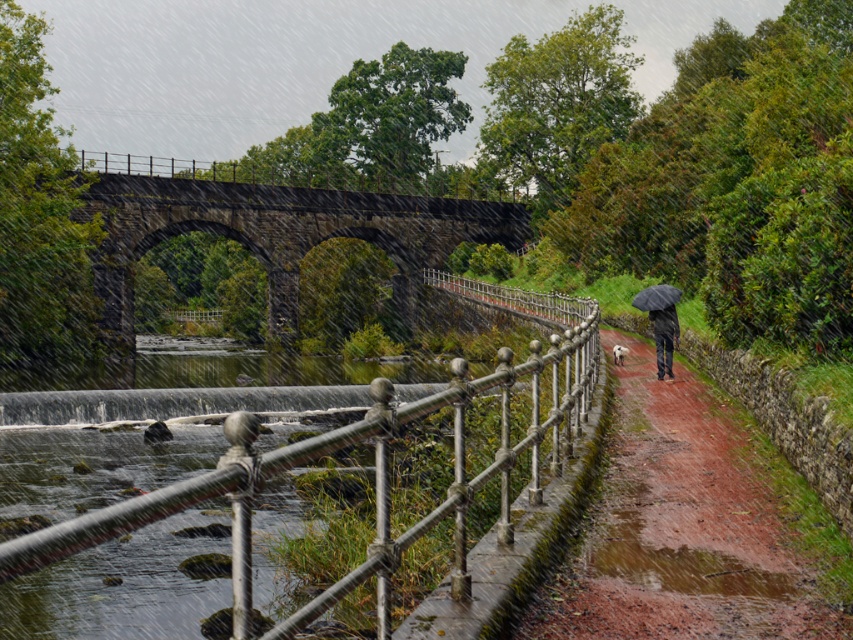
Does silver metallic railing at center appear under dark gray jeans at center-right?

Incorrect, silver metallic railing at center is not positioned below dark gray jeans at center-right.

Is silver metallic railing at center smaller than dark gray jeans at center-right?

No, silver metallic railing at center is not smaller than dark gray jeans at center-right.

Is point (593, 371) farther from viewer compared to point (672, 346)?

No, it is in front of (672, 346).

At what (x,y) coordinates should I click in order to perform the action: click on silver metallic railing at center. Please return your answer as a coordinate pair (x, y). Looking at the image, I should click on (374, 465).

Looking at this image, is the position of dark stone bridge at upper center more distant than that of dark gray jeans at center-right?

Yes, it is.

Does dark stone bridge at upper center come in front of dark gray jeans at center-right?

No, dark stone bridge at upper center is behind dark gray jeans at center-right.

Between point (405, 276) and point (660, 340), which one is positioned in front?

Point (660, 340) is in front.

Locate an element on the screen. The image size is (853, 640). dark stone bridge at upper center is located at coordinates (279, 234).

Image resolution: width=853 pixels, height=640 pixels. Describe the element at coordinates (374, 465) in the screenshot. I see `silver metallic railing at center` at that location.

Does silver metallic railing at center appear on the left side of black matte umbrella at center-right?

Correct, you'll find silver metallic railing at center to the left of black matte umbrella at center-right.

Does point (419, 534) come behind point (640, 292)?

No, it is not.

Locate an element on the screen. The height and width of the screenshot is (640, 853). silver metallic railing at center is located at coordinates (374, 465).